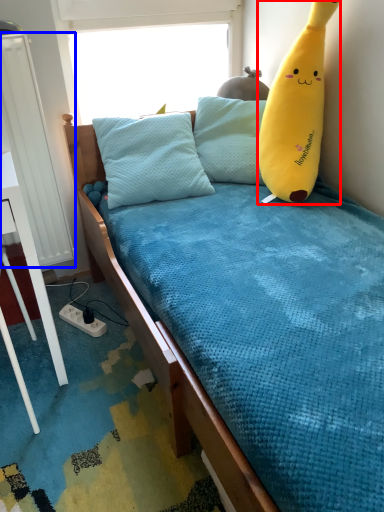
Question: Which object is closer to the camera taking this photo, banana (highlighted by a red box) or radiator (highlighted by a blue box)?

Choices:
 (A) banana
 (B) radiator

Answer: (A)